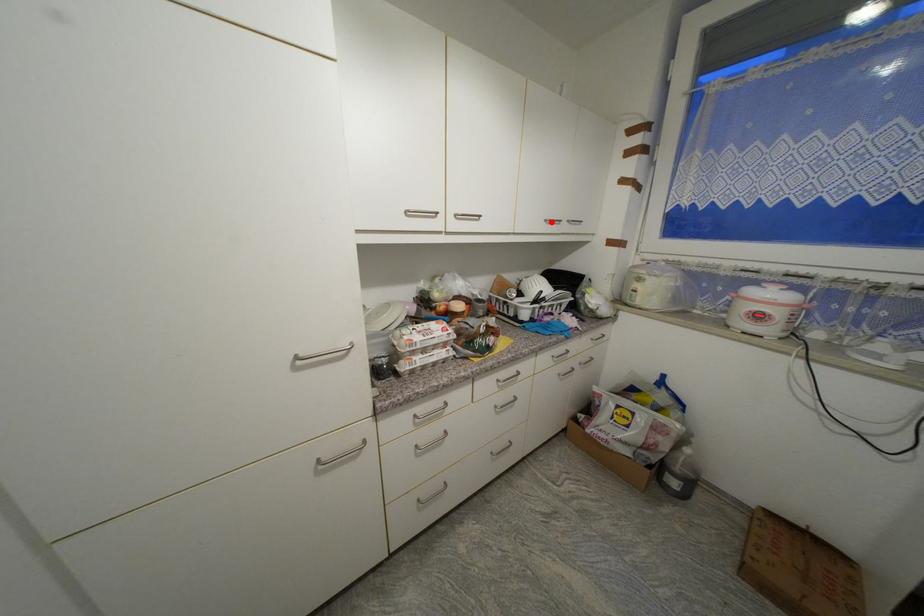
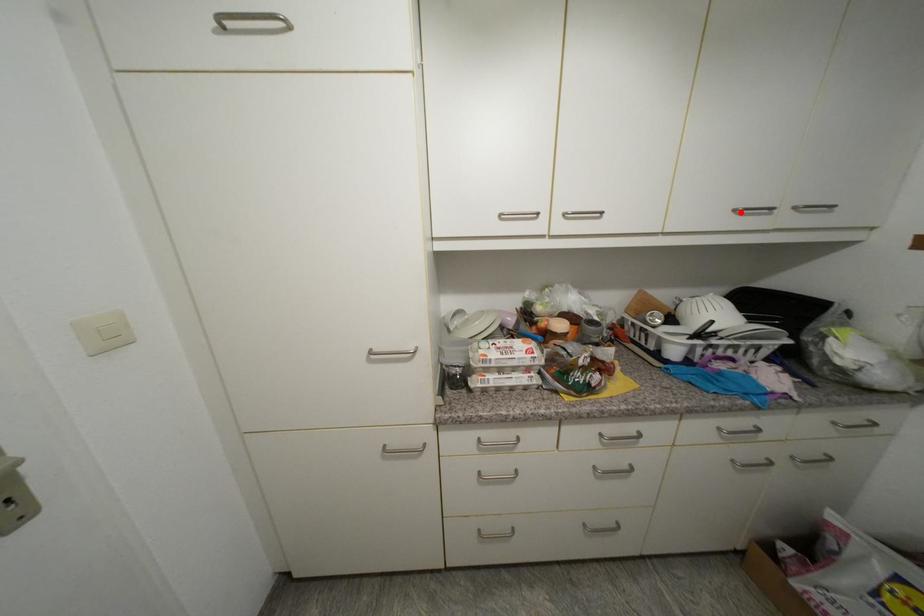
I am providing you with two images of the same scene from different viewpoints. A red point is marked on the first image and another point is marked on the second image. Is the marked point in image1 the same physical position as the marked point in image2?

Yes